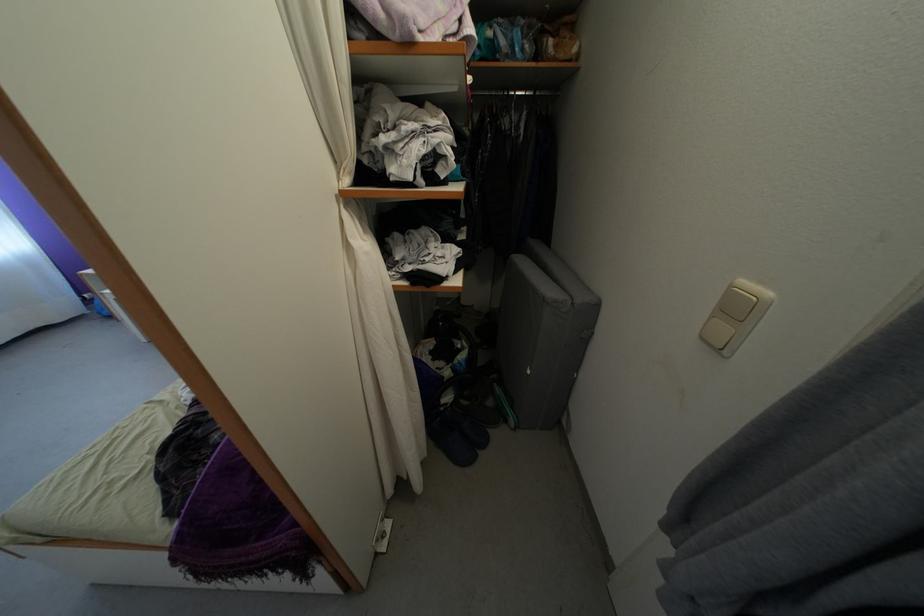
Locate an element on the screen. The height and width of the screenshot is (616, 924). grey folding cushion is located at coordinates (541, 333).